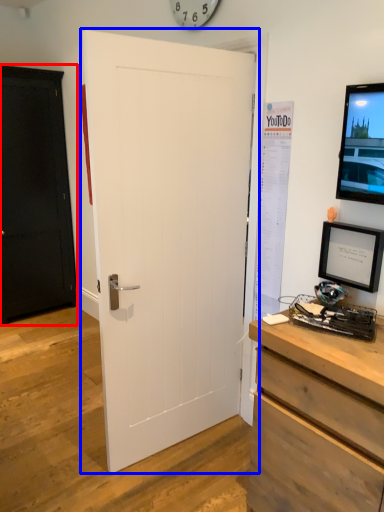
Question: Among these objects, which one is farthest to the camera, door (highlighted by a red box) or door (highlighted by a blue box)?

Choices:
 (A) door
 (B) door

Answer: (A)